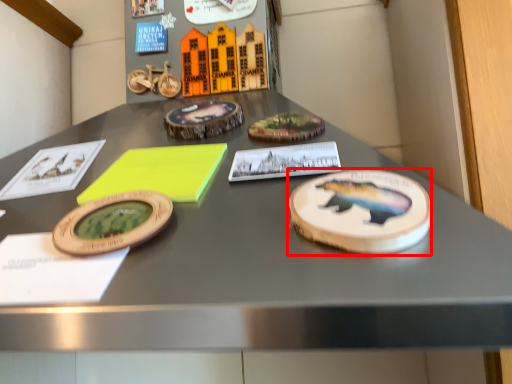
Question: From the image's perspective, considering the relative positions of cake (annotated by the red box) and notepad in the image provided, where is cake (annotated by the red box) located with respect to the staircase?

Choices:
 (A) below
 (B) above

Answer: (A)